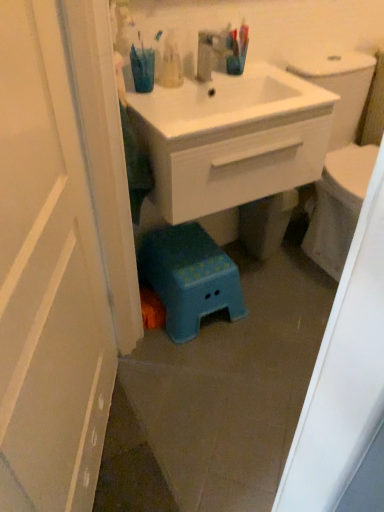
Find the location of a particular element. This screenshot has width=384, height=512. vacant region above blue plastic step stool at lower center (from a real-world perspective) is located at coordinates (192, 249).